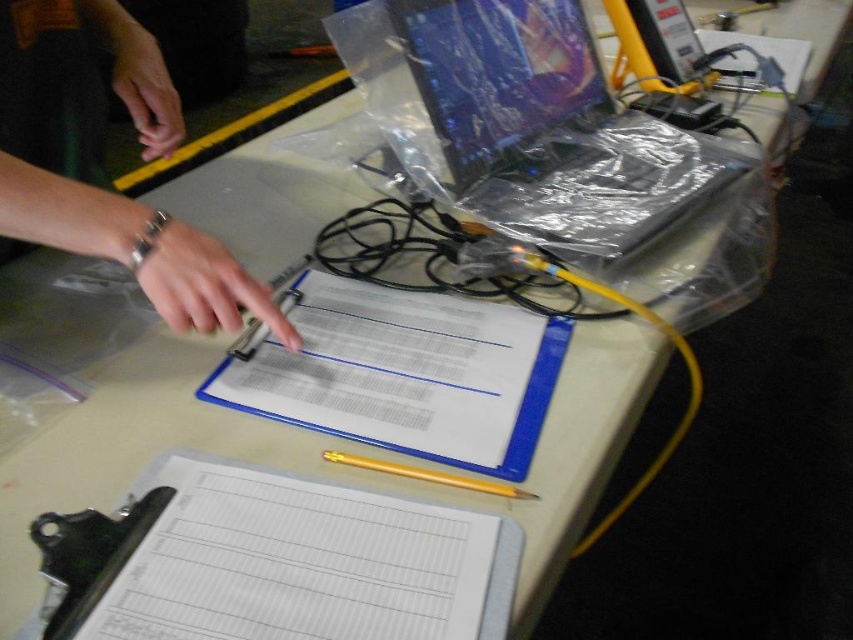
Between point (531, 212) and point (183, 260), which one is positioned in front?

Point (183, 260) is more forward.

Between clear plastic laptop at upper right and smooth beige hand at center, which one appears on the left side from the viewer's perspective?

Positioned to the left is smooth beige hand at center.

Locate an element on the screen. clear plastic laptop at upper right is located at coordinates (550, 129).

Between white paper at lower left and clear plastic laptop at upper right, which one appears on the right side from the viewer's perspective?

clear plastic laptop at upper right is more to the right.

Measure the distance between white paper at lower left and camera.

white paper at lower left is 16.64 inches away from camera.

Where is `white paper at lower left`? Image resolution: width=853 pixels, height=640 pixels. white paper at lower left is located at coordinates (276, 561).

Which is behind, point (175, 234) or point (273, 314)?

Positioned behind is point (273, 314).

Is point (91, 241) less distant than point (144, 266)?

Yes, point (91, 241) is closer to viewer.

Does point (24, 196) come behind point (172, 269)?

No.

Find the location of `silver metallic bracelet at upper left`. silver metallic bracelet at upper left is located at coordinates (137, 250).